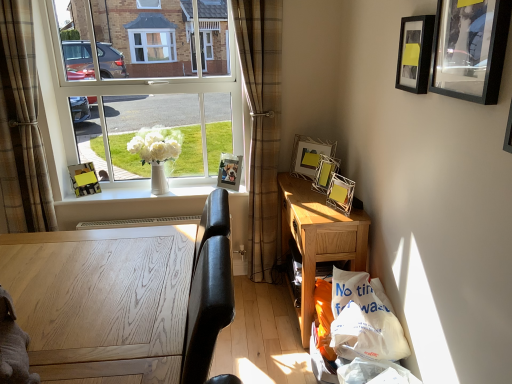
This screenshot has height=384, width=512. Identify the location of unoccupied region to the right of gray plush toy at lower left. pyautogui.click(x=103, y=355).